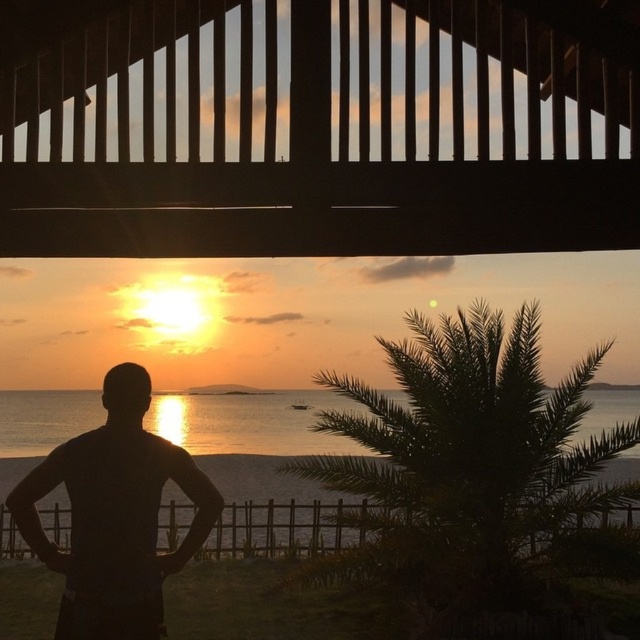
Question: Can you confirm if silvery water at center is wider than black matte man at center?

Choices:
 (A) no
 (B) yes

Answer: (B)

Question: Is silvery water at center to the left of brown wooden rail at lower center from the viewer's perspective?

Choices:
 (A) yes
 (B) no

Answer: (A)

Question: Which object is farther from the camera taking this photo?

Choices:
 (A) brown wooden rail at lower center
 (B) silvery water at center

Answer: (A)

Question: Based on their relative distances, which object is farther from the silvery water at center?

Choices:
 (A) brown wooden rail at lower center
 (B) black matte man at center

Answer: (B)

Question: Is black matte man at center to the left of brown wooden rail at lower center from the viewer's perspective?

Choices:
 (A) no
 (B) yes

Answer: (B)

Question: Among these points, which one is farthest from the camera?

Choices:
 (A) (275, 528)
 (B) (120, 371)
 (C) (301, 481)

Answer: (C)